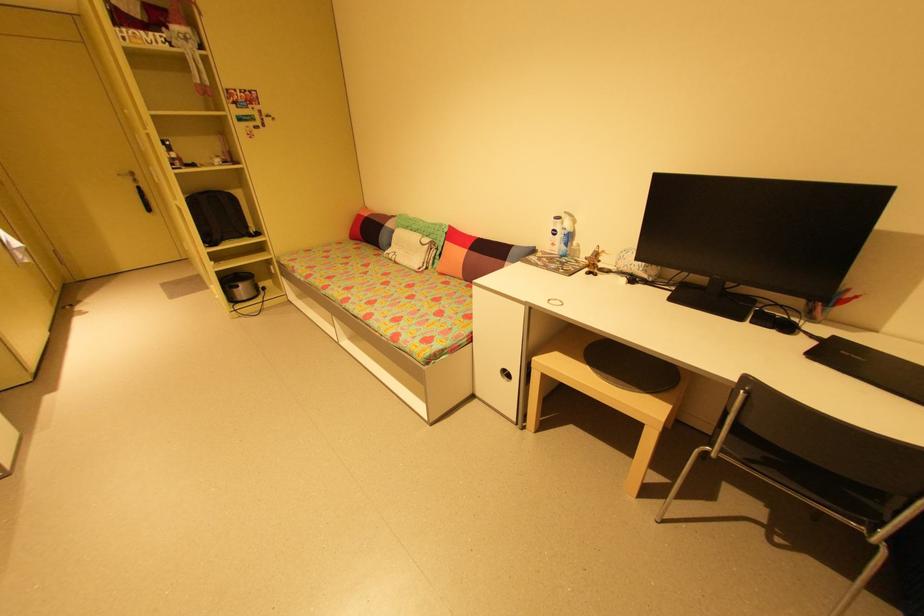
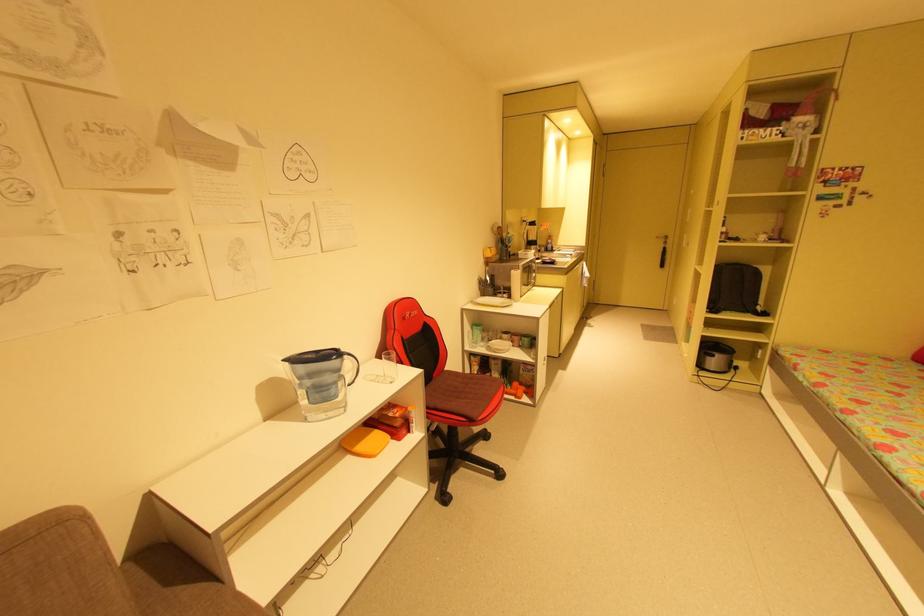
Question: The camera is either moving clockwise (left) or counter-clockwise (right) around the object. The first image is from the beginning of the video and the second image is from the end. Is the camera moving left or right when shooting the video?

Choices:
 (A) Left
 (B) Right

Answer: (B)